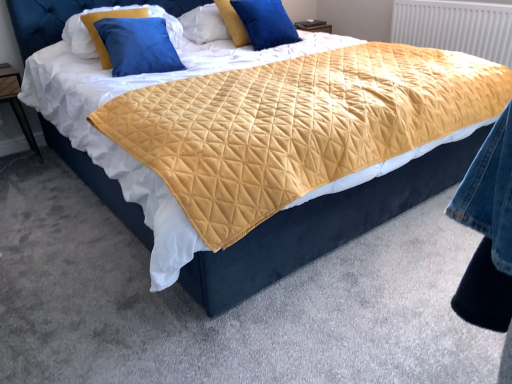
Question: Considering the relative sizes of blue velvet pillow at upper left, arranged as the first pillow when viewed from the left, and wooden nightstand at left in the image provided, is blue velvet pillow at upper left, arranged as the first pillow when viewed from the left, shorter than wooden nightstand at left?

Choices:
 (A) no
 (B) yes

Answer: (B)

Question: Is wooden nightstand at left at the back of blue velvet pillow at upper left, marked as the second pillow in a right-to-left arrangement?

Choices:
 (A) no
 (B) yes

Answer: (A)

Question: Is blue velvet pillow at upper left, marked as the second pillow in a right-to-left arrangement, facing towards wooden nightstand at left?

Choices:
 (A) no
 (B) yes

Answer: (A)

Question: Is blue velvet pillow at upper left, marked as the second pillow in a right-to-left arrangement, outside of wooden nightstand at left?

Choices:
 (A) no
 (B) yes

Answer: (B)

Question: Can you confirm if blue velvet pillow at upper left, marked as the second pillow in a right-to-left arrangement, is thinner than wooden nightstand at left?

Choices:
 (A) no
 (B) yes

Answer: (B)

Question: Is wooden nightstand at left spatially inside blue velvet pillow at upper left, marked as the second pillow in a right-to-left arrangement, or outside of it?

Choices:
 (A) outside
 (B) inside

Answer: (A)

Question: Visually, is wooden nightstand at left positioned to the left or to the right of blue velvet pillow at upper left, arranged as the first pillow when viewed from the left?

Choices:
 (A) left
 (B) right

Answer: (A)

Question: Is wooden nightstand at left wider or thinner than blue velvet pillow at upper left, marked as the second pillow in a right-to-left arrangement?

Choices:
 (A) wide
 (B) thin

Answer: (A)

Question: In terms of height, does wooden nightstand at left look taller or shorter compared to blue velvet pillow at upper left, arranged as the first pillow when viewed from the left?

Choices:
 (A) tall
 (B) short

Answer: (A)

Question: Relative to yellow quilted radiator at upper right, is wooden nightstand at left in front or behind?

Choices:
 (A) front
 (B) behind

Answer: (A)

Question: From the image's perspective, relative to yellow quilted radiator at upper right, is wooden nightstand at left above or below?

Choices:
 (A) above
 (B) below

Answer: (B)

Question: Is wooden nightstand at left inside or outside of yellow quilted radiator at upper right?

Choices:
 (A) outside
 (B) inside

Answer: (A)

Question: Is point (14, 89) closer or farther from the camera than point (420, 23)?

Choices:
 (A) closer
 (B) farther

Answer: (A)

Question: From a real-world perspective, is yellow quilted pillow at upper center, which ranks as the 2th pillow in left-to-right order, physically located above or below wooden nightstand at left?

Choices:
 (A) below
 (B) above

Answer: (B)

Question: In the image, is yellow quilted pillow at upper center, the first pillow from the right, on the left side or the right side of wooden nightstand at left?

Choices:
 (A) right
 (B) left

Answer: (A)